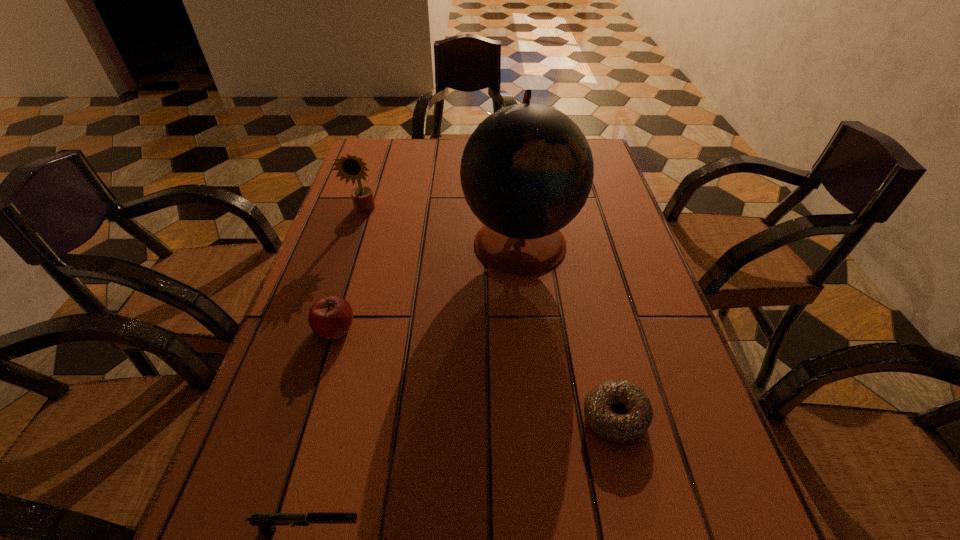
At what (x,y) coordinates should I click in order to perform the action: click on free space that is in between the doughnut and the second tallest object. Please return your answer as a coordinate pair (x, y). This screenshot has width=960, height=540. Looking at the image, I should click on (490, 314).

The image size is (960, 540). In order to click on blank region between the third nearest object and the globe in this screenshot , I will do `click(427, 285)`.

Image resolution: width=960 pixels, height=540 pixels. I want to click on unoccupied position between the apple and the shortest object, so click(475, 373).

This screenshot has width=960, height=540. What are the coordinates of `free space between the gun and the third farthest object` in the screenshot? It's located at (322, 429).

This screenshot has width=960, height=540. In order to click on object that is the second nearest to the second nearest object in this screenshot , I will do `click(266, 522)`.

Identify which object is located as the nearest to the globe. Please provide its 2D coordinates. Your answer should be formatted as a tuple, i.e. [(x, y)], where the tuple contains the x and y coordinates of a point satisfying the conditions above.

[(348, 167)]

You are a GUI agent. You are given a task and a screenshot of the screen. Output one action in this format:
    pyautogui.click(x=<x>, y=<y>)
    Task: Click on the free spot that satisfies the following two spatial constraints: 1. with the Americas facing the viewer on the globe; 2. on the back side of the shortest object
    This screenshot has height=540, width=960.
    Given the screenshot: What is the action you would take?
    pyautogui.click(x=538, y=417)

Locate an element on the screen. vacant space that satisfies the following two spatial constraints: 1. on the face of the second tallest object; 2. on the left side of the apple is located at coordinates (326, 328).